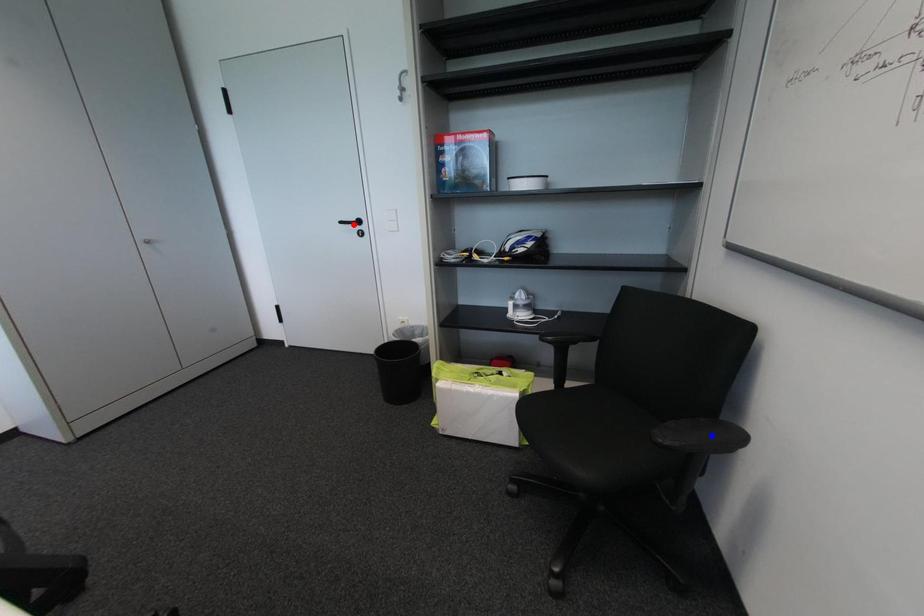
Question: Two points are marked on the image. Which point is closer to the camera?

Choices:
 (A) Blue point is closer.
 (B) Red point is closer.

Answer: (A)